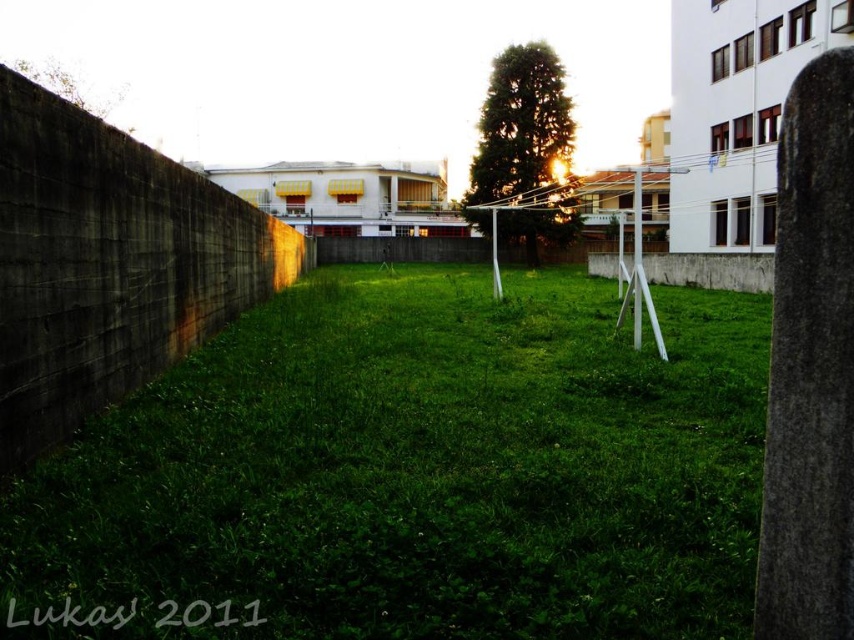
You are standing at the edge of the gray concrete wall at left and want to walk towards the green grassy at center. Which direction should you move?

You should move to the right because the green grassy at center is to the right of the gray concrete wall at left.

You are standing in the outdoor scene described. You notice two points marked in the image. Which point, point (x=565, y=442) or point (x=231, y=230), is nearer to you?

Point (x=565, y=442) is closer to the viewer than point (x=231, y=230).

You are standing in the outdoor scene and want to take a photo of the gray concrete wall at left without the green grassy at center appearing in the foreground. Is this possible?

The green grassy at center is closer to the viewer than the gray concrete wall at left, so it would block the view of the gray concrete wall at left. Therefore, it is not possible to take a photo of the gray concrete wall at left without the green grassy at center appearing in the foreground.